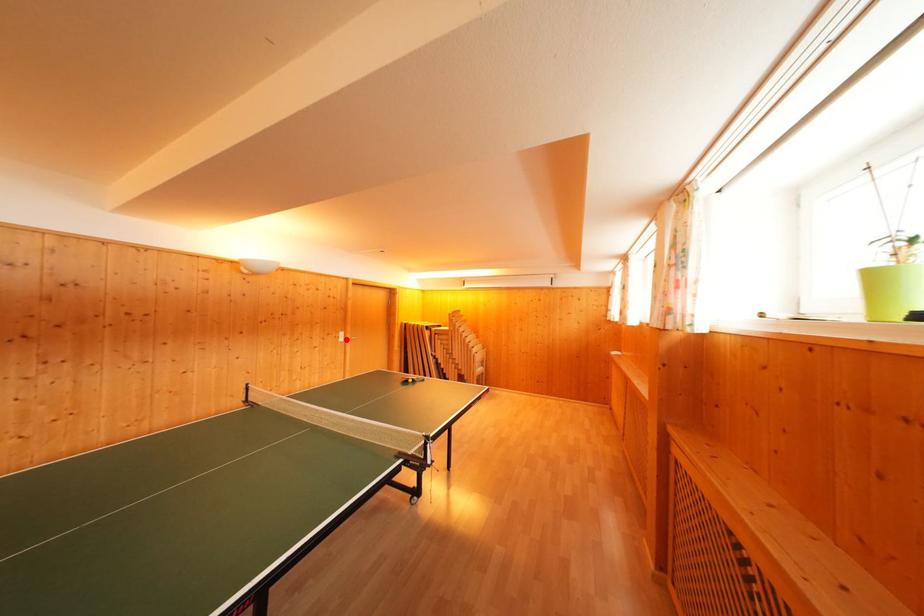
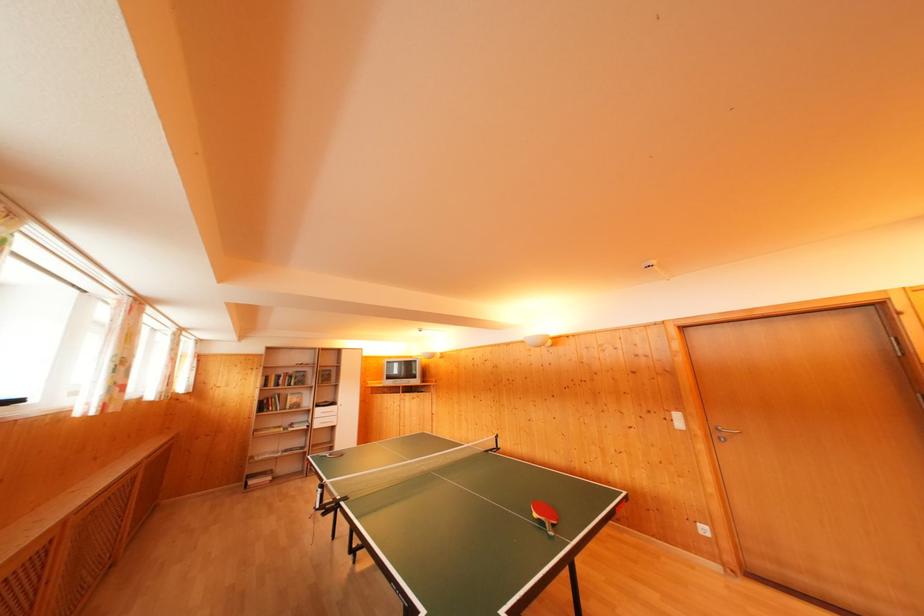
The point at the highlighted location is marked in the first image. Where is the corresponding point in the second image?

(682, 421)